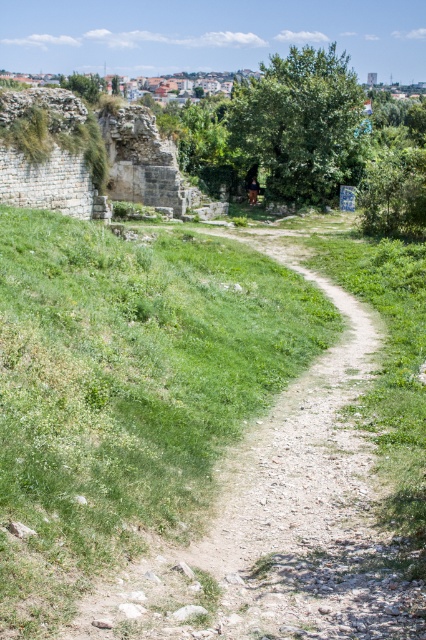
A hiker is standing at the point marked as point (17, 228) and wants to reach a viewpoint located 25 meters away. Can they make it without walking more than 25 meters?

The distance between the hiker at point (17, 228) and the viewpoint is 22.55 meters, which is within the 25 meters limit. Yes, the hiker can reach the viewpoint without exceeding the distance.

You are standing on the dirt path and see the green grassy at center and the brown leather jacket at center. Which object is closer to the ground?

The green grassy at center is located below the brown leather jacket at center, so the green grassy at center is closer to the ground.